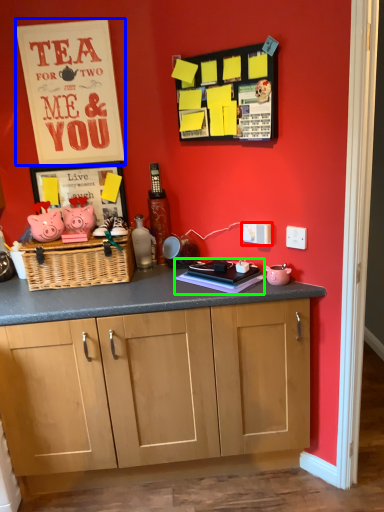
Question: Which object is positioned farthest from electric outlet (highlighted by a red box)? Select from postcard (highlighted by a blue box) and book (highlighted by a green box).

Choices:
 (A) postcard
 (B) book

Answer: (A)